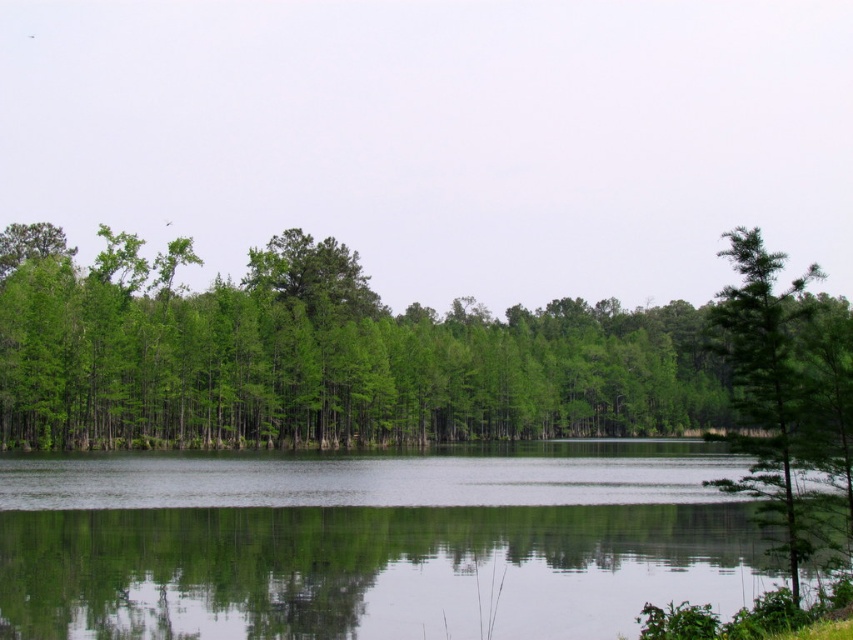
You are standing at the edge of the water and want to take a photo of the green leafy tree at right. Since the transparent water at center is between you and the tree, will the tree be visible through the water?

The transparent water at center is in front of green leafy tree at right, so yes, the tree will be visible through the transparent water at center because the water is transparent and positioned in front of it.

You are standing at the edge of the water in the serene landscape. You notice a point marked at coordinates (x=322, y=358). What does this point indicate?

The point at (x=322, y=358) indicates green matte trees at center.

You are standing at the edge of the water and want to walk towards the green leafy tree at right. Which direction should you go to avoid the green matte trees at center?

To avoid the green matte trees at center, you should walk towards the right side since the green leafy tree at right is located above the green matte trees at center, meaning it is positioned higher up and to the right in the scene.